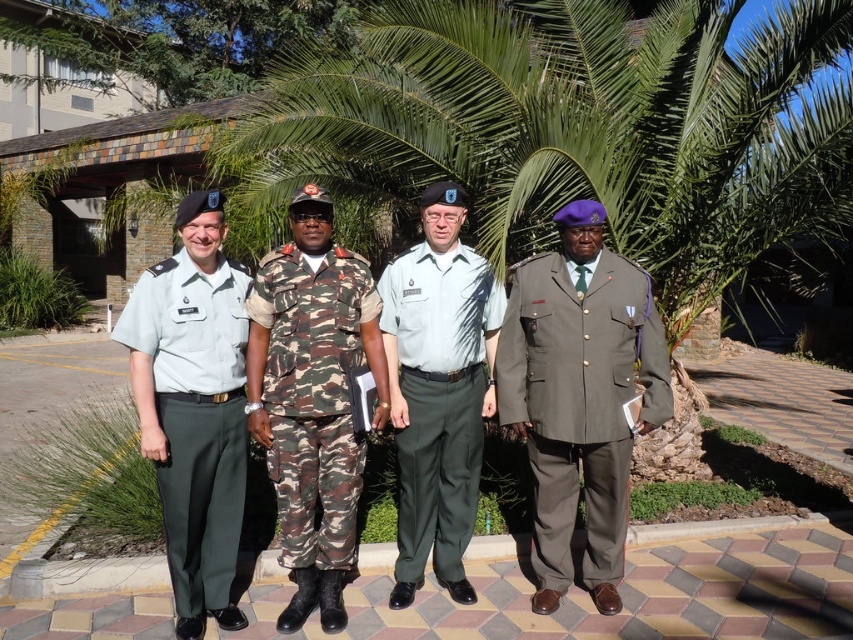
Is point (286, 246) behind point (454, 572)?

No, it is in front of (454, 572).

Who is positioned more to the left, camo fabric uniform at center or light gray cotton shirt at center?

Positioned to the left is camo fabric uniform at center.

At what (x,y) coordinates should I click in order to perform the action: click on camo fabric uniform at center. Please return your answer as a coordinate pair (x, y). The height and width of the screenshot is (640, 853). Looking at the image, I should click on (312, 396).

Is matte olive-green uniform at center taller than camo fabric uniform at center?

Yes.

Is point (538, 470) farther from camera compared to point (339, 385)?

Yes, it is.

Is point (520, 378) in front of point (345, 509)?

That is False.

What are the coordinates of `matte olive-green uniform at center` in the screenshot? It's located at [x=579, y=401].

Does light green fabric uniform at left lie behind light gray cotton shirt at center?

No, it is not.

Describe the element at coordinates (195, 417) in the screenshot. I see `light green fabric uniform at left` at that location.

Where is `light green fabric uniform at left`? The width and height of the screenshot is (853, 640). light green fabric uniform at left is located at coordinates (195, 417).